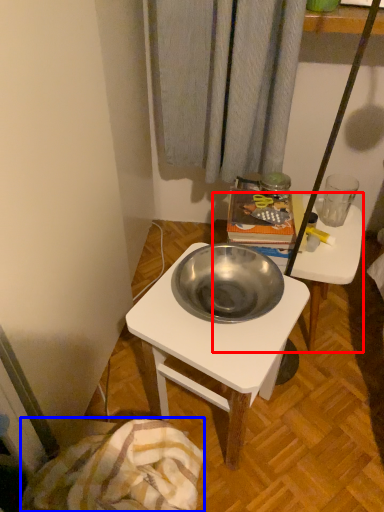
Question: Which object is further to the camera taking this photo, table (highlighted by a red box) or blanket (highlighted by a blue box)?

Choices:
 (A) table
 (B) blanket

Answer: (A)